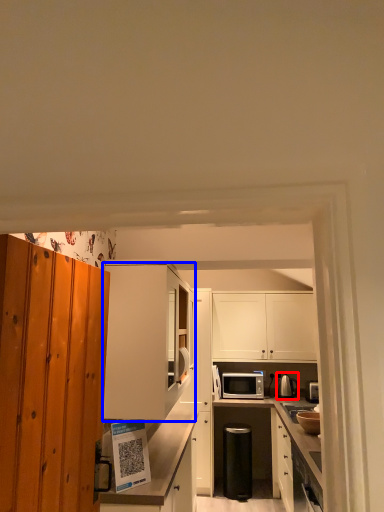
Question: Which of the following is the closest to the observer, appliance (highlighted by a red box) or cabinetry (highlighted by a blue box)?

Choices:
 (A) appliance
 (B) cabinetry

Answer: (B)